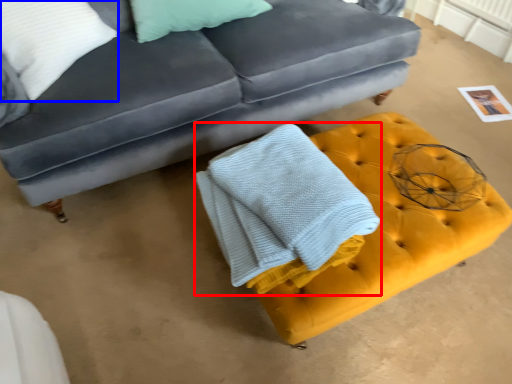
Question: Which object appears farthest to the camera in this image, bath towel (highlighted by a red box) or pillow (highlighted by a blue box)?

Choices:
 (A) bath towel
 (B) pillow

Answer: (B)